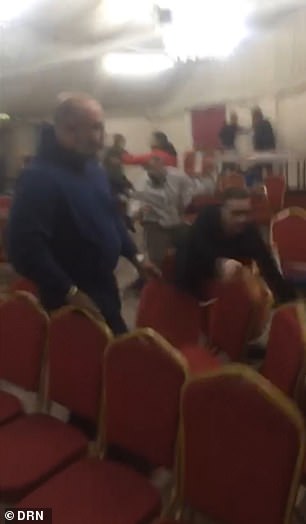
What are the coordinates of `ceiling` in the screenshot? It's located at (70, 32).